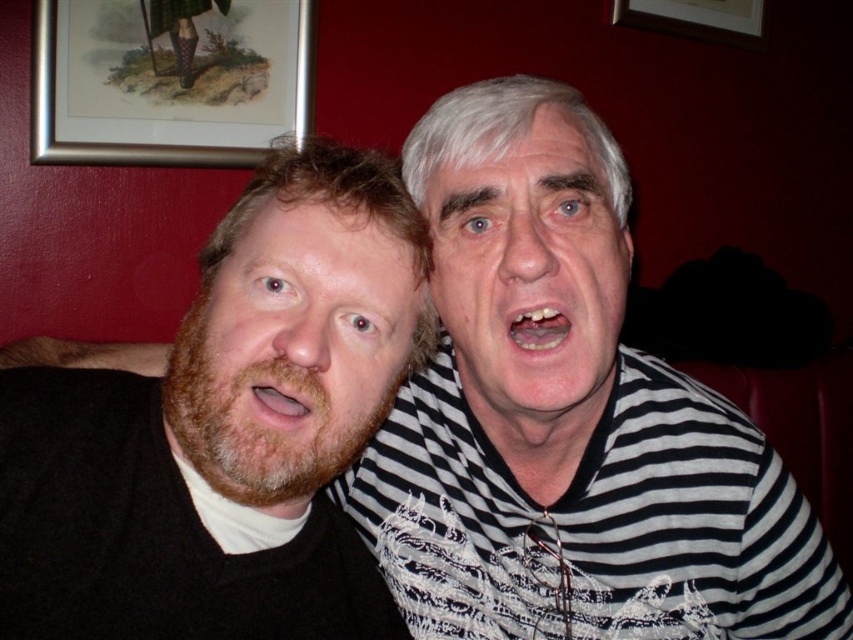
Question: Which of the following is the closest to the observer?

Choices:
 (A) dark brown hair at left
 (B) yellowish plastic teeth at center

Answer: (A)

Question: Where is white striped shirt at center located in relation to matte brown beard at lower left in the image?

Choices:
 (A) right
 (B) left

Answer: (A)

Question: From the image, what is the correct spatial relationship of dark brown hair at left in relation to yellowish plastic teeth at center?

Choices:
 (A) right
 (B) left

Answer: (B)

Question: Which point appears closest to the camera in this image?

Choices:
 (A) (386, 276)
 (B) (679, 28)

Answer: (A)

Question: Is white striped shirt at center to the left of wooden picture frame at upper center from the viewer's perspective?

Choices:
 (A) no
 (B) yes

Answer: (B)

Question: Which point appears closest to the camera in this image?

Choices:
 (A) (361, 346)
 (B) (556, 321)

Answer: (A)